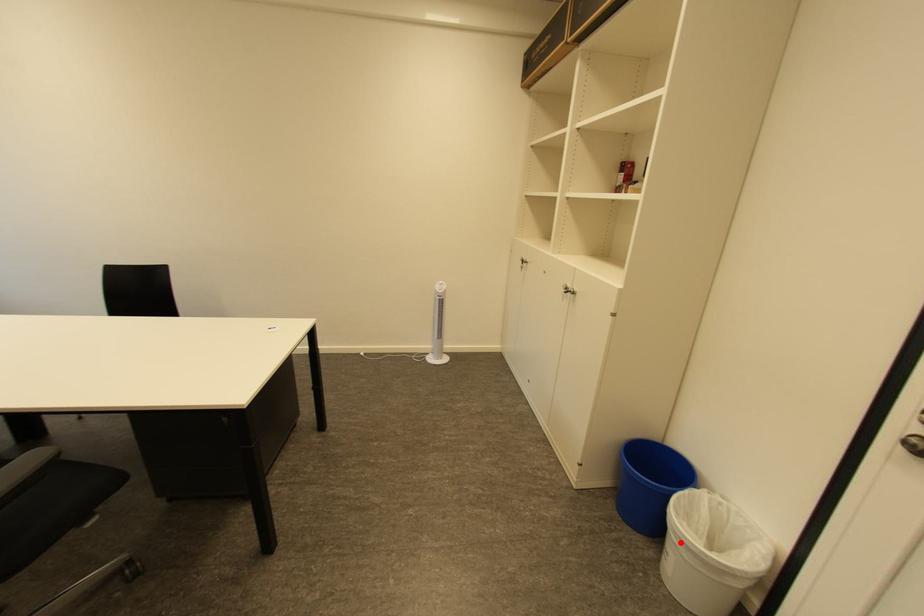
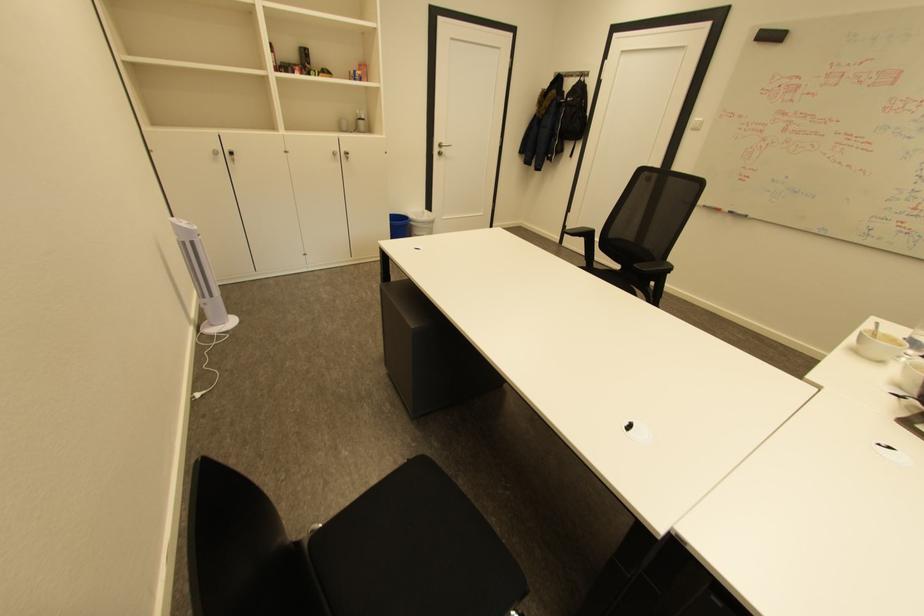
Question: I am providing you with two images of the same scene from different viewpoints. Image1 has a red point marked. In image2, the corresponding 3D location appears at what relative position? Reply with the corresponding letter.

Choices:
 (A) Closer
 (B) Farther

Answer: (A)